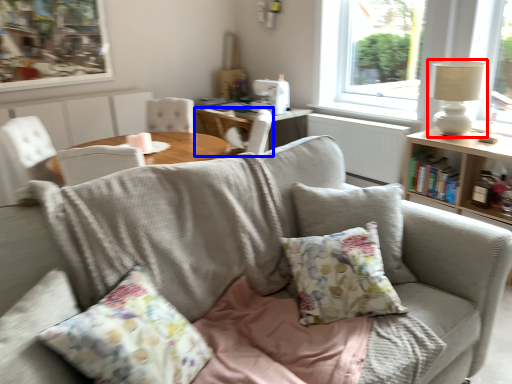
Question: Which point is further to the camera, table lamp (highlighted by a red box) or chair (highlighted by a blue box)?

Choices:
 (A) table lamp
 (B) chair

Answer: (B)